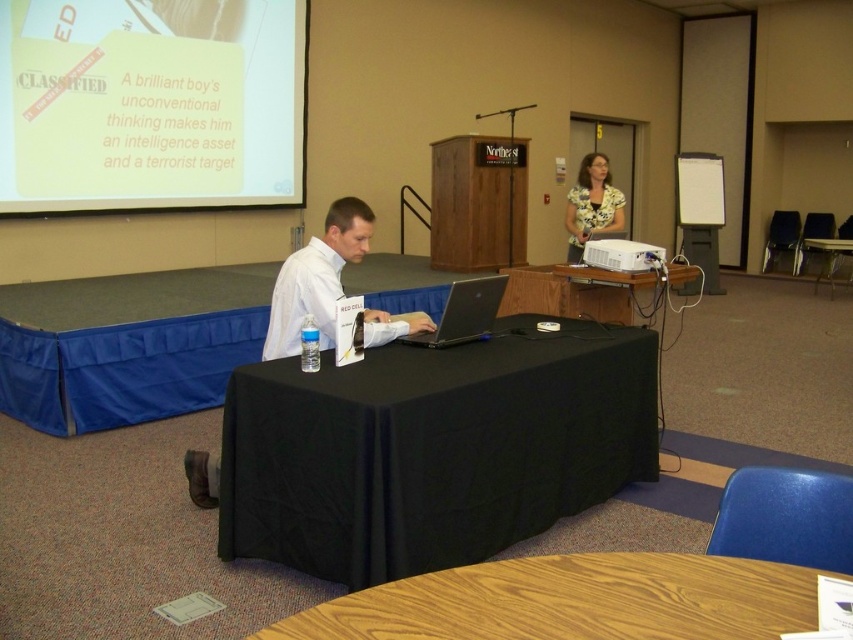
Who is more forward, (556, 444) or (578, 212)?

Point (556, 444) is more forward.

Who is lower down, black fabric table at center or matte yellow blouse at upper right?

black fabric table at center

Where is `black fabric table at center`? This screenshot has height=640, width=853. black fabric table at center is located at coordinates (433, 448).

Can you confirm if black matte laptop at center is taller than white plastic projector at upper center?

Yes, black matte laptop at center is taller than white plastic projector at upper center.

The height and width of the screenshot is (640, 853). What are the coordinates of `black matte laptop at center` in the screenshot? It's located at (463, 312).

Who is more distant from viewer, (473, 278) or (606, 268)?

Point (606, 268)

Find the location of `black matte laptop at center`. black matte laptop at center is located at coordinates (463, 312).

Who is positioned more to the right, black fabric table at center or wooden table at lower center?

From the viewer's perspective, wooden table at lower center appears more on the right side.

Which is below, black fabric table at center or wooden table at lower center?

Positioned lower is wooden table at lower center.

Between point (582, 436) and point (805, 573), which one is positioned behind?

The point (582, 436) is more distant.

The height and width of the screenshot is (640, 853). What are the coordinates of `black fabric table at center` in the screenshot? It's located at (433, 448).